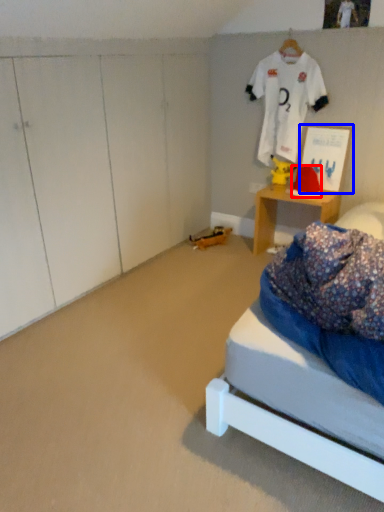
Question: Which point is closer to the camera, hat (highlighted by a red box) or picture frame (highlighted by a blue box)?

Choices:
 (A) hat
 (B) picture frame

Answer: (B)